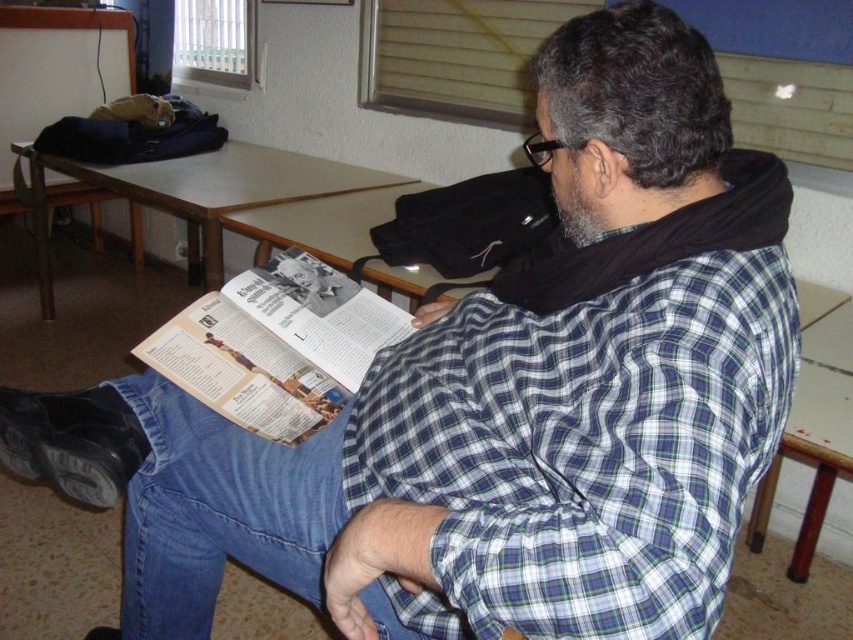
Question: Estimate the real-world distances between objects in this image. Which object is closer to the printed paper magazine at center?

Choices:
 (A) green and white checkered shirt at center
 (B) wooden chair at lower right

Answer: (A)

Question: Which of the following is the farthest from the observer?

Choices:
 (A) green and white checkered shirt at center
 (B) wooden chair at lower right
 (C) printed paper magazine at center

Answer: (C)

Question: Is printed paper magazine at center further to the viewer compared to wooden chair at lower right?

Choices:
 (A) no
 (B) yes

Answer: (B)

Question: Does green and white checkered shirt at center appear on the left side of wooden chair at lower right?

Choices:
 (A) no
 (B) yes

Answer: (B)

Question: Which object is positioned farthest from the wooden chair at lower right?

Choices:
 (A) green and white checkered shirt at center
 (B) printed paper magazine at center

Answer: (B)

Question: Is green and white checkered shirt at center smaller than wooden chair at lower right?

Choices:
 (A) no
 (B) yes

Answer: (A)